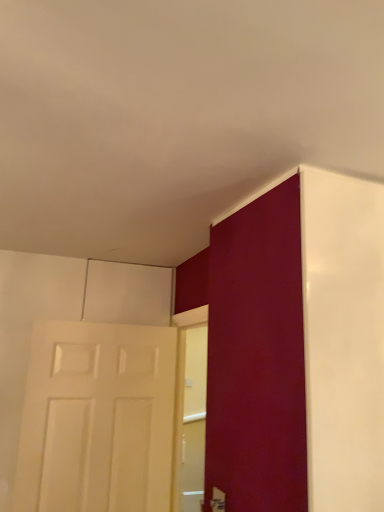
Question: Does white matte door at left, arranged as the 1th door when viewed from the back, have a greater width compared to matte white door at right, the first door viewed from the right?

Choices:
 (A) no
 (B) yes

Answer: (A)

Question: Could you tell me if white matte door at left, which appears as the second door when viewed from the right, is turned towards matte white door at right, the first door viewed from the right?

Choices:
 (A) yes
 (B) no

Answer: (A)

Question: From a real-world perspective, is white matte door at left, the first door viewed from the left, on matte white door at right, placed as the 2th door when sorted from back to front?

Choices:
 (A) yes
 (B) no

Answer: (B)

Question: Considering the relative sizes of white matte door at left, the first door viewed from the left, and matte white door at right, placed as the 2th door when sorted from back to front, in the image provided, is white matte door at left, the first door viewed from the left, smaller than matte white door at right, placed as the 2th door when sorted from back to front,?

Choices:
 (A) yes
 (B) no

Answer: (A)

Question: Would you say matte white door at right, the second door viewed from the left, is part of white matte door at left, the 2th door positioned from the front,'s contents?

Choices:
 (A) no
 (B) yes

Answer: (A)

Question: Does white matte door at left, the first door viewed from the left, have a lesser width compared to matte white door at right, the first door viewed from the right?

Choices:
 (A) yes
 (B) no

Answer: (A)

Question: Is matte white door at right, the second door viewed from the left, not close to white matte door at left, which appears as the second door when viewed from the right?

Choices:
 (A) yes
 (B) no

Answer: (B)

Question: Is matte white door at right, the first door viewed from the right, positioned before white matte door at left, which appears as the second door when viewed from the right?

Choices:
 (A) yes
 (B) no

Answer: (A)

Question: Is matte white door at right, the second door viewed from the left, facing towards white matte door at left, the first door viewed from the left?

Choices:
 (A) yes
 (B) no

Answer: (B)

Question: Is matte white door at right, the first door viewed from the right, completely or partially outside of white matte door at left, arranged as the 1th door when viewed from the back?

Choices:
 (A) yes
 (B) no

Answer: (A)

Question: Is matte white door at right, which is counted as the 1th door, starting from the front, further to the viewer compared to white matte door at left, which appears as the second door when viewed from the right?

Choices:
 (A) no
 (B) yes

Answer: (A)

Question: From the image's perspective, would you say matte white door at right, the second door viewed from the left, is shown under white matte door at left, which appears as the second door when viewed from the right?

Choices:
 (A) yes
 (B) no

Answer: (B)

Question: From the image's perspective, is white matte door at left, which appears as the second door when viewed from the right, above or below matte white door at right, placed as the 2th door when sorted from back to front?

Choices:
 (A) below
 (B) above

Answer: (A)